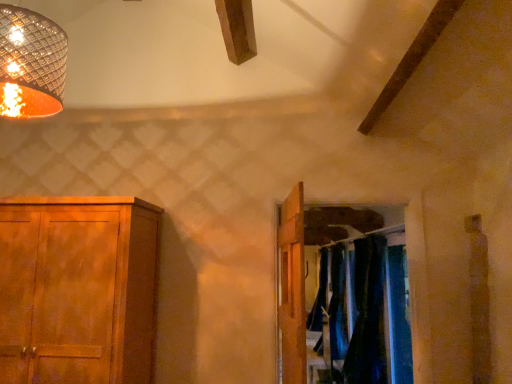
Question: Considering the relative sizes of dark blue fabric at center and metallic woven shade at upper left in the image provided, is dark blue fabric at center shorter than metallic woven shade at upper left?

Choices:
 (A) no
 (B) yes

Answer: (A)

Question: Is dark blue fabric at center wider than metallic woven shade at upper left?

Choices:
 (A) yes
 (B) no

Answer: (B)

Question: Is dark blue fabric at center in contact with metallic woven shade at upper left?

Choices:
 (A) yes
 (B) no

Answer: (B)

Question: Can you confirm if dark blue fabric at center is taller than metallic woven shade at upper left?

Choices:
 (A) no
 (B) yes

Answer: (B)

Question: Can you confirm if dark blue fabric at center is thinner than metallic woven shade at upper left?

Choices:
 (A) yes
 (B) no

Answer: (A)

Question: Would you say dark blue fabric at center is to the left or to the right of wooden door at center in the picture?

Choices:
 (A) right
 (B) left

Answer: (A)

Question: Choose the correct answer: Is dark blue fabric at center inside wooden door at center or outside it?

Choices:
 (A) outside
 (B) inside

Answer: (A)

Question: Considering their positions, is dark blue fabric at center located in front of or behind wooden door at center?

Choices:
 (A) behind
 (B) front

Answer: (A)

Question: From the image's perspective, relative to wooden door at center, is dark blue fabric at center above or below?

Choices:
 (A) above
 (B) below

Answer: (B)

Question: Which is correct: wooden door at center is inside blue velvet curtains at center, arranged as the 1th curtain when viewed from the back, or outside of it?

Choices:
 (A) outside
 (B) inside

Answer: (A)

Question: Considering the relative positions of wooden door at center and blue velvet curtains at center, arranged as the 1th curtain when viewed from the back, in the image provided, is wooden door at center to the left or to the right of blue velvet curtains at center, arranged as the 1th curtain when viewed from the back,?

Choices:
 (A) left
 (B) right

Answer: (A)

Question: Relative to blue velvet curtains at center, arranged as the 1th curtain when viewed from the back, is wooden door at center in front or behind?

Choices:
 (A) front
 (B) behind

Answer: (A)

Question: From a real-world perspective, is wooden door at center positioned above or below blue velvet curtains at center, which appears as the 2th curtain when viewed from the front?

Choices:
 (A) above
 (B) below

Answer: (A)

Question: From a real-world perspective, relative to velvet dark blue curtains at right, which is the 1th curtain in front-to-back order, is wooden door at center vertically above or below?

Choices:
 (A) below
 (B) above

Answer: (B)

Question: Is point (285, 304) closer or farther from the camera than point (371, 274)?

Choices:
 (A) farther
 (B) closer

Answer: (B)